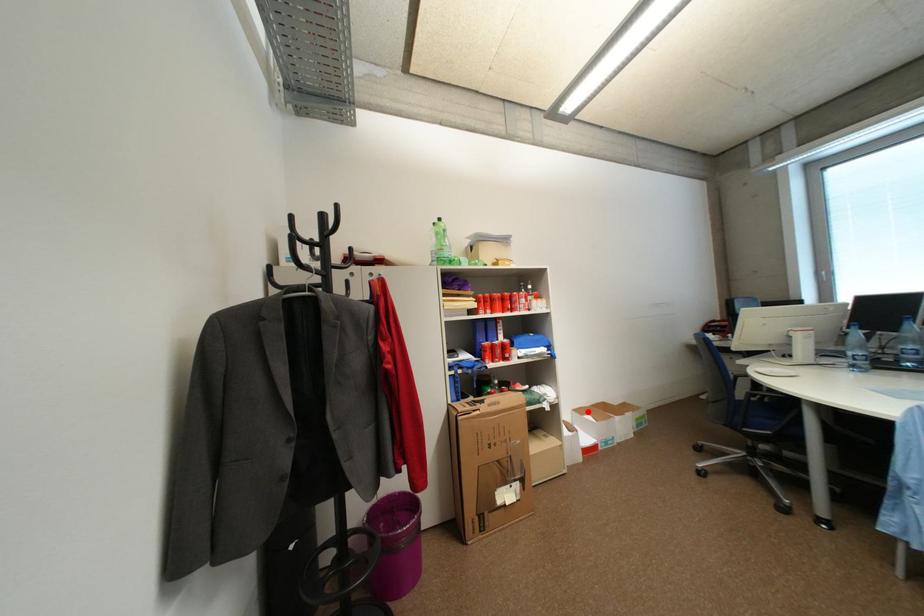
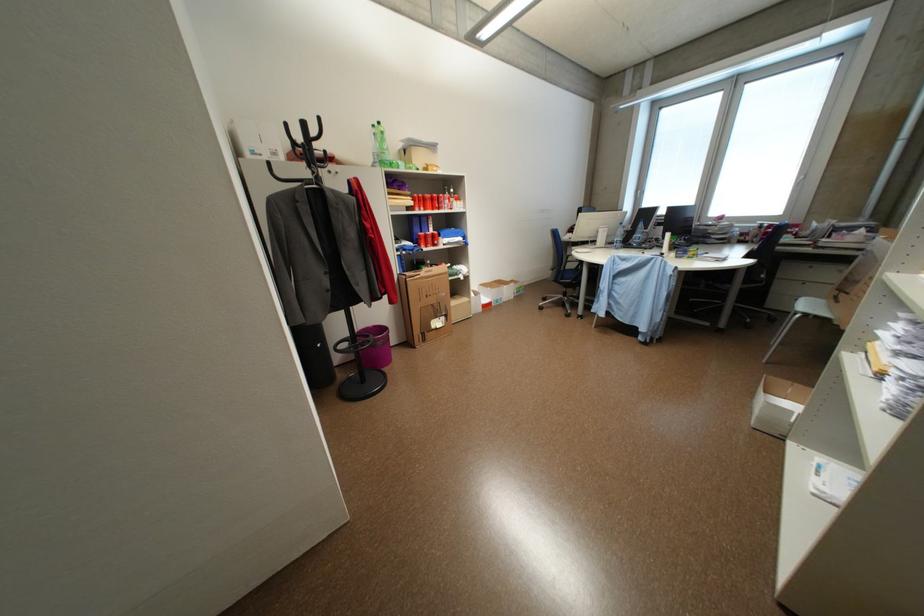
Question: I am providing you with two images of the same scene from different viewpoints. Image1 has a red point marked. In image2, the corresponding 3D location appears at what relative position? Reply with the corresponding letter.

Choices:
 (A) Closer
 (B) Farther

Answer: (A)